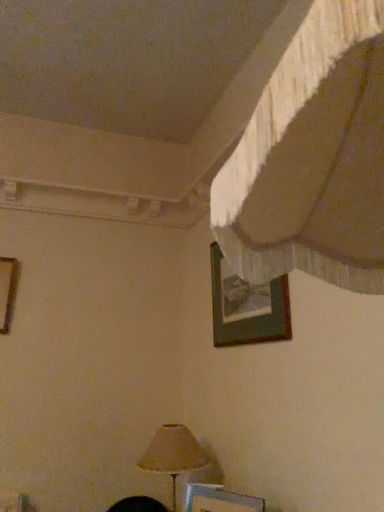
Question: Should I look upward or downward to see metallic silver picture frame at lower center, which is the 3th picture frame in top-to-bottom order?

Choices:
 (A) down
 (B) up

Answer: (A)

Question: Is wooden picture frame at upper center, which is counted as the third picture frame, starting from the left, placed right next to wooden picture frame at left, which is the 2th picture frame in top-to-bottom order?

Choices:
 (A) yes
 (B) no

Answer: (B)

Question: Is wooden picture frame at upper center, placed as the first picture frame when sorted from right to left, taller than wooden picture frame at left, positioned as the second picture frame in bottom-to-top order?

Choices:
 (A) yes
 (B) no

Answer: (A)

Question: From a real-world perspective, is wooden picture frame at upper center, which is the first picture frame from top to bottom, physically above wooden picture frame at left, which ranks as the first picture frame in left-to-right order?

Choices:
 (A) yes
 (B) no

Answer: (B)

Question: Does wooden picture frame at upper center, which is the first picture frame from top to bottom, contain wooden picture frame at left, positioned as the second picture frame in bottom-to-top order?

Choices:
 (A) no
 (B) yes

Answer: (A)

Question: Would you consider wooden picture frame at upper center, placed as the first picture frame when sorted from right to left, to be distant from wooden picture frame at left, which ranks as the first picture frame in left-to-right order?

Choices:
 (A) yes
 (B) no

Answer: (A)

Question: Is wooden picture frame at upper center, placed as the first picture frame when sorted from right to left, positioned with its back to wooden picture frame at left, arranged as the third picture frame when viewed from the right?

Choices:
 (A) yes
 (B) no

Answer: (B)

Question: From a real-world perspective, is wooden picture frame at left, which ranks as the first picture frame in left-to-right order, below matte beige lampshade at lower center?

Choices:
 (A) yes
 (B) no

Answer: (B)

Question: From the image's perspective, does wooden picture frame at left, which ranks as the first picture frame in left-to-right order, appear higher than matte beige lampshade at lower center?

Choices:
 (A) yes
 (B) no

Answer: (A)

Question: Can you confirm if wooden picture frame at left, which is the 2th picture frame in top-to-bottom order, is taller than matte beige lampshade at lower center?

Choices:
 (A) yes
 (B) no

Answer: (B)

Question: From the image's perspective, would you say wooden picture frame at left, positioned as the second picture frame in bottom-to-top order, is shown under matte beige lampshade at lower center?

Choices:
 (A) no
 (B) yes

Answer: (A)

Question: Is wooden picture frame at left, arranged as the third picture frame when viewed from the right, at the left side of matte beige lampshade at lower center?

Choices:
 (A) yes
 (B) no

Answer: (A)

Question: Is wooden picture frame at left, which ranks as the first picture frame in left-to-right order, oriented towards matte beige lampshade at lower center?

Choices:
 (A) no
 (B) yes

Answer: (A)

Question: Considering the relative positions of wooden picture frame at upper center, which is counted as the third picture frame, starting from the left, and metallic silver picture frame at lower center, which is the second picture frame from left to right, in the image provided, is wooden picture frame at upper center, which is counted as the third picture frame, starting from the left, in front of metallic silver picture frame at lower center, which is the second picture frame from left to right,?

Choices:
 (A) no
 (B) yes

Answer: (A)